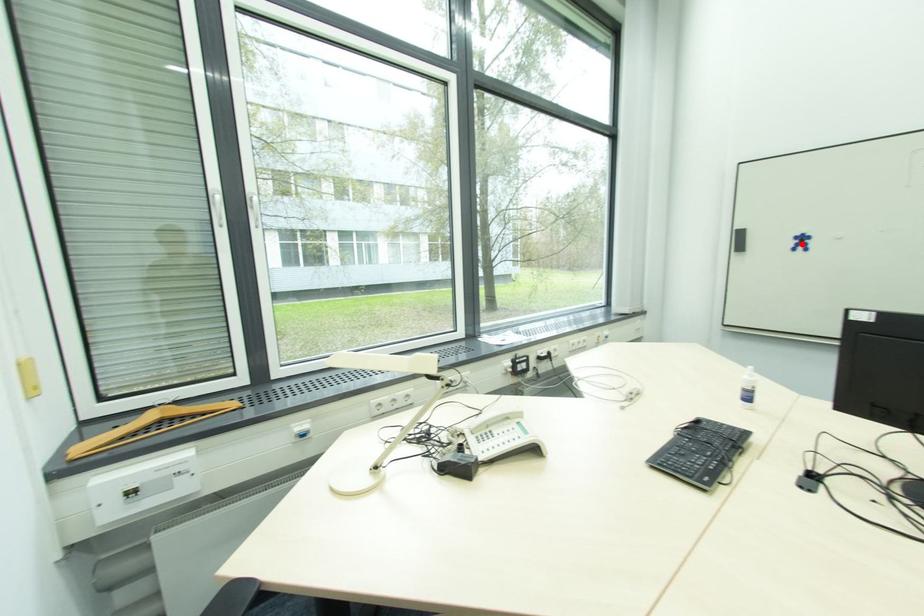
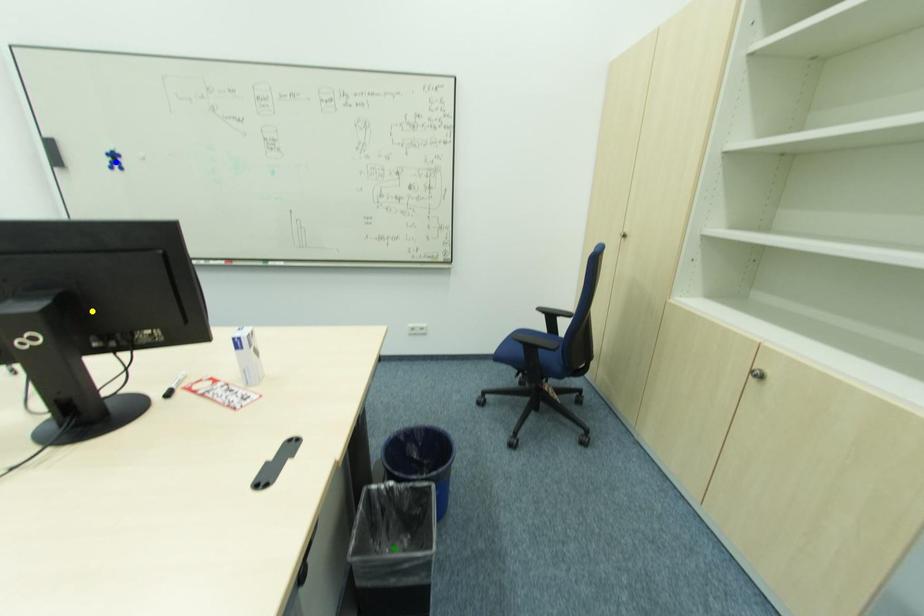
Question: I am providing you with two images of the same scene from different viewpoints. A red point is marked on the first image. You are given multiple points on the second image. Can you choose the point in image 2 that corresponds to the point in image 1?

Choices:
 (A) blue point
 (B) yellow point
 (C) green point

Answer: (A)